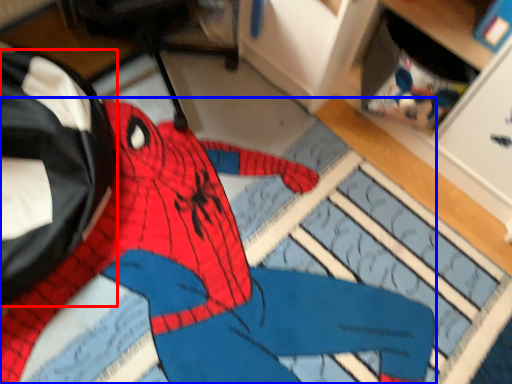
Question: Which of the following is the closest to the observer, messenger bag (highlighted by a red box) or person (highlighted by a blue box)?

Choices:
 (A) messenger bag
 (B) person

Answer: (B)